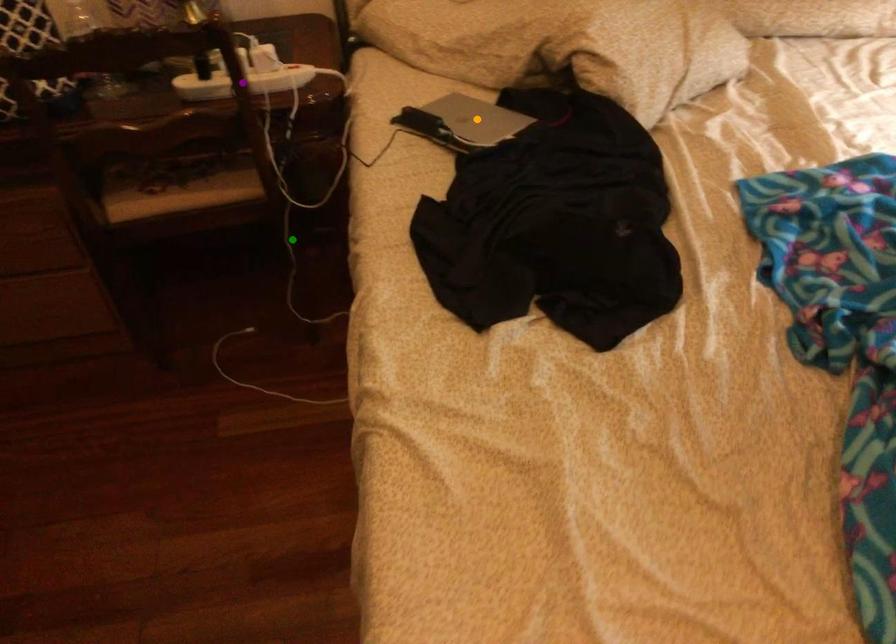
Order these from nearest to farthest:
purple point
green point
orange point

1. green point
2. purple point
3. orange point